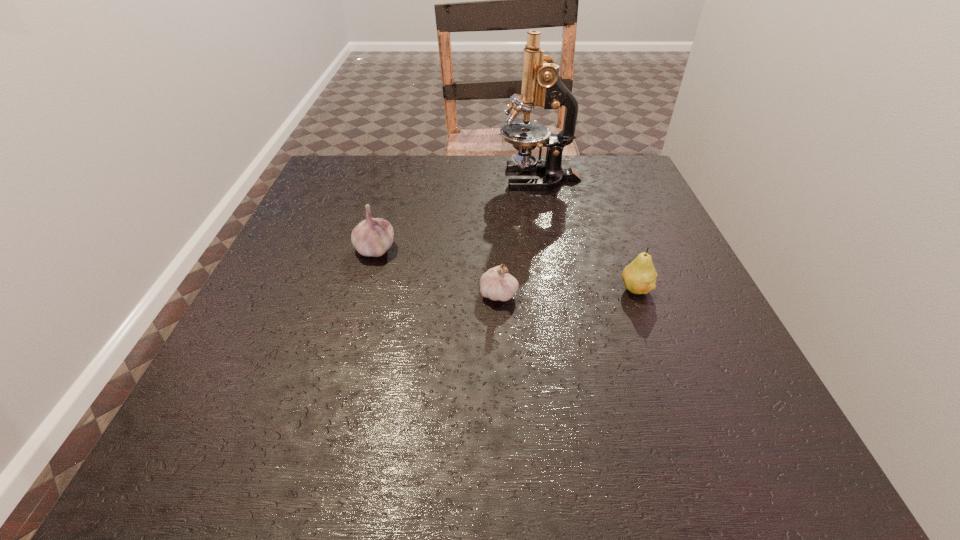
Locate an element on the screen. The image size is (960, 540). the tallest object is located at coordinates (541, 86).

I want to click on the farthest object, so click(541, 86).

Find the location of a particular element. This screenshot has height=540, width=960. the left garlic is located at coordinates (373, 237).

Find the location of a particular element. The image size is (960, 540). the taller garlic is located at coordinates (373, 237).

Image resolution: width=960 pixels, height=540 pixels. Identify the location of the rightmost object. (639, 277).

This screenshot has height=540, width=960. In order to click on the right garlic in this screenshot , I will do `click(496, 284)`.

Image resolution: width=960 pixels, height=540 pixels. Identify the location of the shortest object. (496, 284).

Identify the location of free location located 0.160m at the eyepiece of the farthest object. Image resolution: width=960 pixels, height=540 pixels. (434, 178).

You are a GUI agent. You are given a task and a screenshot of the screen. Output one action in this format:
    pyautogui.click(x=<x>, y=<y>)
    Task: Click on the free space located at the eyepiece of the farthest object
    
    Given the screenshot: What is the action you would take?
    pyautogui.click(x=343, y=178)

I want to click on vacant space located 0.400m at the eyepiece of the farthest object, so click(x=339, y=178).